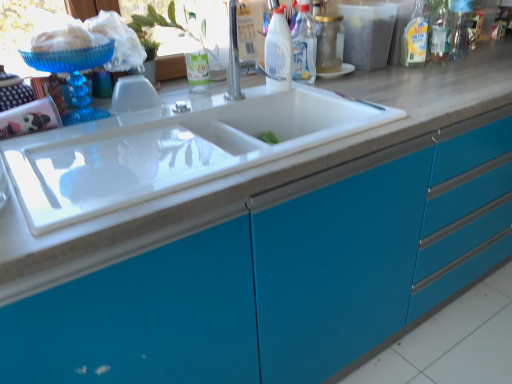
Question: Does white glossy bottle at upper center, arranged as the third bottle when viewed from the right, appear on the left side of transparent plastic window screen at upper center?

Choices:
 (A) no
 (B) yes

Answer: (A)

Question: From a real-world perspective, is white glossy bottle at upper center, the second bottle in the left-to-right sequence, under transparent plastic window screen at upper center?

Choices:
 (A) no
 (B) yes

Answer: (A)

Question: From the image's perspective, is white glossy bottle at upper center, the second bottle in the left-to-right sequence, on top of transparent plastic window screen at upper center?

Choices:
 (A) no
 (B) yes

Answer: (B)

Question: Considering the relative positions of white glossy bottle at upper center, the second bottle in the left-to-right sequence, and transparent plastic window screen at upper center in the image provided, is white glossy bottle at upper center, the second bottle in the left-to-right sequence, to the right of transparent plastic window screen at upper center from the viewer's perspective?

Choices:
 (A) yes
 (B) no

Answer: (A)

Question: Is white glossy bottle at upper center, arranged as the third bottle when viewed from the right, positioned with its back to transparent plastic window screen at upper center?

Choices:
 (A) yes
 (B) no

Answer: (B)

Question: From a real-world perspective, is white glossy bottle at upper center, the second bottle in the left-to-right sequence, on transparent plastic window screen at upper center?

Choices:
 (A) yes
 (B) no

Answer: (A)

Question: Is the depth of silver metallic faucet at upper center greater than that of blue glossy cabinet at center?

Choices:
 (A) no
 (B) yes

Answer: (B)

Question: From a real-world perspective, is silver metallic faucet at upper center located higher than blue glossy cabinet at center?

Choices:
 (A) no
 (B) yes

Answer: (B)

Question: Does silver metallic faucet at upper center have a larger size compared to blue glossy cabinet at center?

Choices:
 (A) yes
 (B) no

Answer: (B)

Question: Does silver metallic faucet at upper center have a lesser width compared to blue glossy cabinet at center?

Choices:
 (A) no
 (B) yes

Answer: (B)

Question: Is silver metallic faucet at upper center at the left side of blue glossy cabinet at center?

Choices:
 (A) no
 (B) yes

Answer: (B)

Question: From the image's perspective, does silver metallic faucet at upper center appear lower than blue glossy cabinet at center?

Choices:
 (A) no
 (B) yes

Answer: (A)

Question: Is transparent glass jar at upper center, the third bottle positioned from the left, in front of transparent plastic window screen at upper center?

Choices:
 (A) no
 (B) yes

Answer: (A)